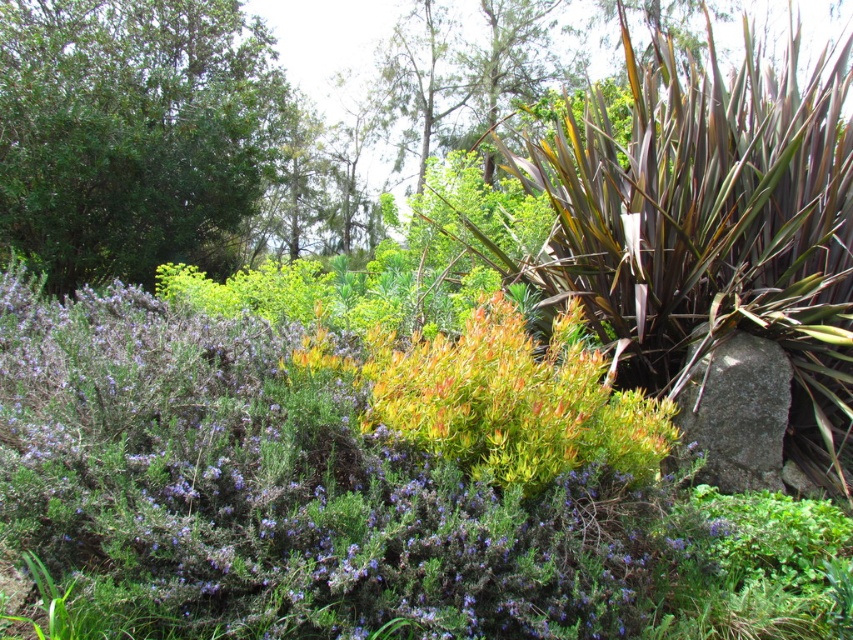
Between purple leafy bush at center and green leafy tree at upper left, which one is positioned higher?

green leafy tree at upper left

Is purple leafy bush at center positioned behind green leafy tree at upper left?

No, it is not.

Between point (281, 536) and point (47, 132), which one is positioned behind?

The point (47, 132) is behind.

This screenshot has height=640, width=853. In order to click on purple leafy bush at center in this screenshot , I will do `click(285, 496)`.

Can you confirm if purple leafy bush at center is positioned above gray rough stone at lower right?

Yes, purple leafy bush at center is above gray rough stone at lower right.

Does purple leafy bush at center have a greater height compared to gray rough stone at lower right?

Indeed, purple leafy bush at center has a greater height compared to gray rough stone at lower right.

Measure the distance between purple leafy bush at center and camera.

purple leafy bush at center is 6.87 feet away from camera.

Locate an element on the screen. The height and width of the screenshot is (640, 853). purple leafy bush at center is located at coordinates (285, 496).

Can you confirm if green leafy tree at upper left is positioned above gray rough stone at lower right?

Indeed, green leafy tree at upper left is positioned over gray rough stone at lower right.

Does green leafy tree at upper left have a smaller size compared to gray rough stone at lower right?

No, green leafy tree at upper left is not smaller than gray rough stone at lower right.

Image resolution: width=853 pixels, height=640 pixels. Find the location of `green leafy tree at upper left`. green leafy tree at upper left is located at coordinates (132, 131).